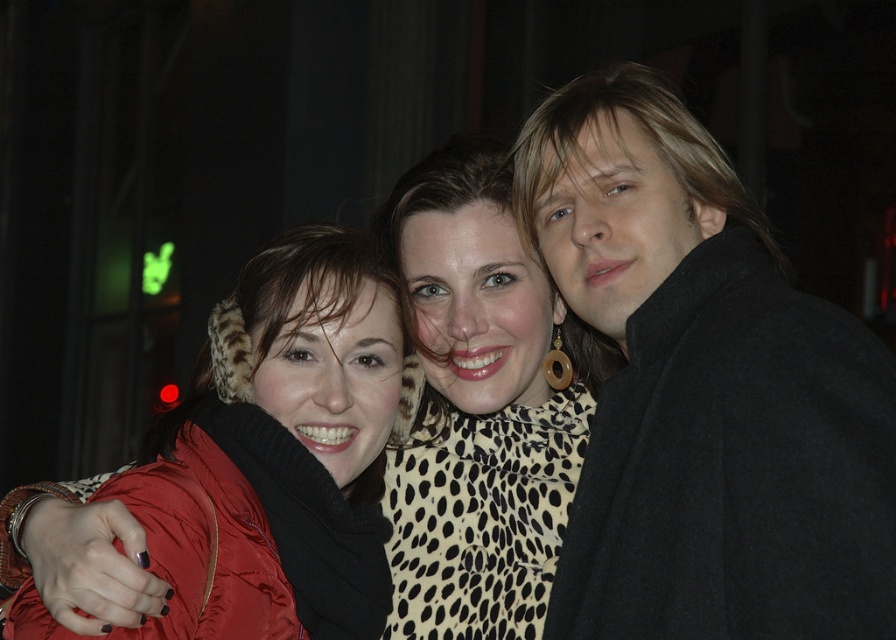
Question: Is black wool coat at right smaller than matte red jacket at left?

Choices:
 (A) yes
 (B) no

Answer: (B)

Question: Can you confirm if black wool coat at right is smaller than leopard print scarf at center?

Choices:
 (A) yes
 (B) no

Answer: (B)

Question: Which point is closer to the camera?

Choices:
 (A) (579, 147)
 (B) (283, 406)
 (C) (584, 433)

Answer: (B)

Question: Which point appears farthest from the camera in this image?

Choices:
 (A) (191, 500)
 (B) (522, 410)

Answer: (B)

Question: Which object appears farthest from the camera in this image?

Choices:
 (A) black wool coat at right
 (B) leopard print scarf at center
 (C) matte red jacket at left

Answer: (B)

Question: Does leopard print scarf at center appear on the right side of matte red jacket at left?

Choices:
 (A) no
 (B) yes

Answer: (B)